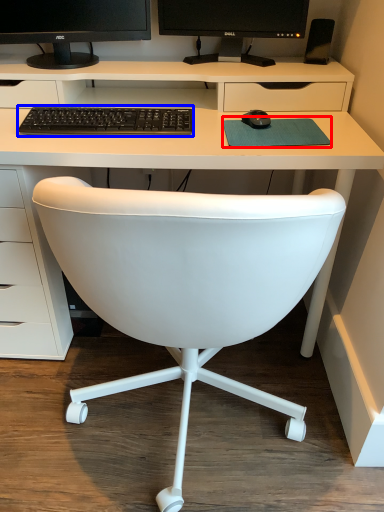
Question: Among these objects, which one is farthest to the camera, mousepad (highlighted by a red box) or computer keyboard (highlighted by a blue box)?

Choices:
 (A) mousepad
 (B) computer keyboard

Answer: (B)